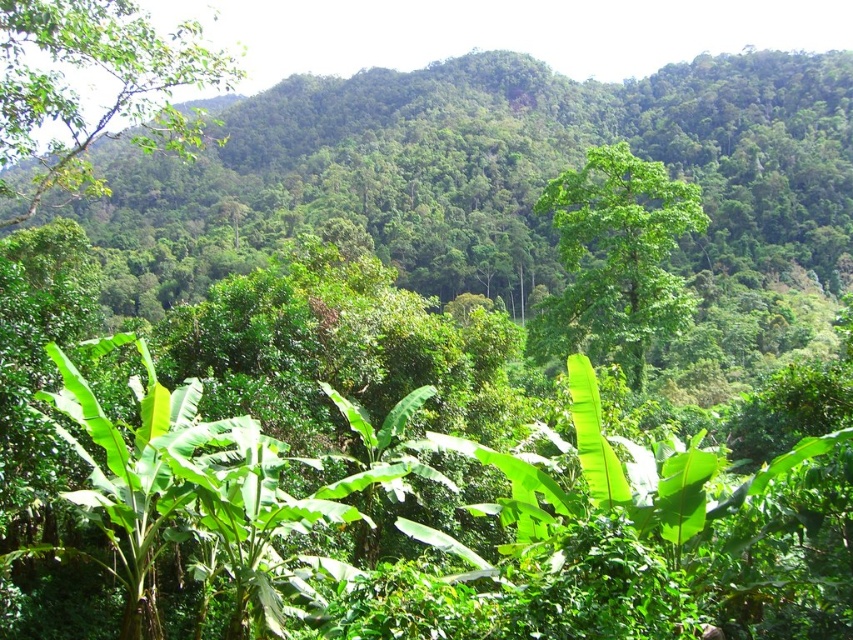
Can you confirm if green leafy tree at center is taller than green leafy banana tree at center?

Yes.

Does green leafy tree at center lie in front of green leafy banana tree at center?

No.

Image resolution: width=853 pixels, height=640 pixels. Find the location of `green leafy tree at center`. green leafy tree at center is located at coordinates point(614,259).

Is green leafy tree at upper left further to camera compared to green leafy banana tree at center?

Yes, green leafy tree at upper left is behind green leafy banana tree at center.

Which is more to the left, green leafy tree at upper left or green leafy banana tree at center?

From the viewer's perspective, green leafy tree at upper left appears more on the left side.

Which is in front, point (181, 84) or point (109, 342)?

Point (109, 342) is in front.

This screenshot has width=853, height=640. Identify the location of green leafy tree at upper left. (79, 93).

Who is more distant from viewer, (51, 60) or (616, 205)?

Point (616, 205)

Can you confirm if green leafy tree at upper left is positioned to the left of green leafy tree at center?

Correct, you'll find green leafy tree at upper left to the left of green leafy tree at center.

Is point (4, 56) farther from viewer compared to point (596, 244)?

No, (4, 56) is in front of (596, 244).

I want to click on green leafy tree at upper left, so click(x=79, y=93).